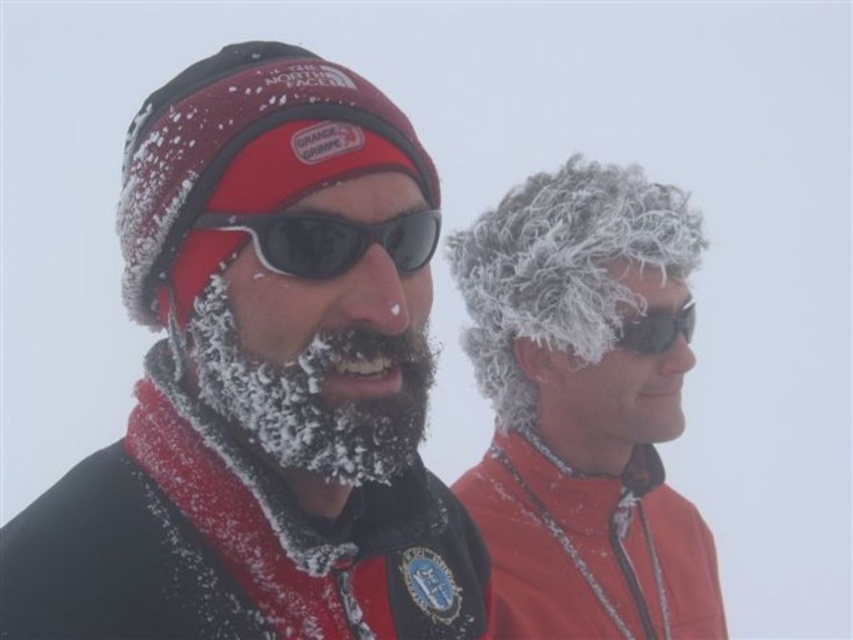
You are standing in a snowy landscape and see the matte black jacket at center and the white frosty beard at center. Which one is positioned to the left?

The matte black jacket at center is positioned to the left of the white frosty beard at center.

You are a photographer trying to capture both the matte black jacket at center and the white frosty beard at center in a single frame. Based on their positions, which object should you adjust your camera angle to focus on first to ensure both are in the shot?

The matte black jacket at center might be wider than white frosty beard at center, so you should focus on the matte black jacket at center first to ensure the wider object is centered before adjusting for the other.